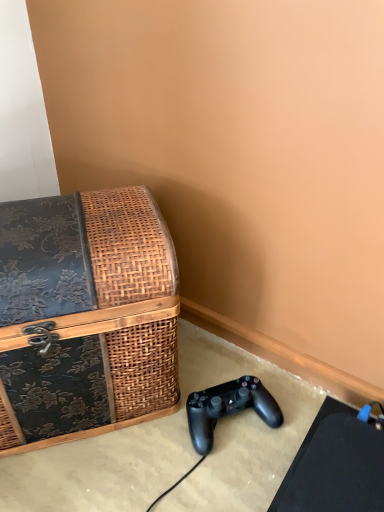
What is the approximate height of black matte game controller at lower right?

The height of black matte game controller at lower right is 2.71 inches.

The width and height of the screenshot is (384, 512). Describe the element at coordinates (228, 408) in the screenshot. I see `black matte game controller at lower right` at that location.

Where is `black matte game controller at lower right`? black matte game controller at lower right is located at coordinates (228, 408).

Identify the location of woven wood trunk at left. (85, 316).

This screenshot has height=512, width=384. What do you see at coordinates (85, 316) in the screenshot?
I see `woven wood trunk at left` at bounding box center [85, 316].

Where is `black matte game controller at lower right`? The width and height of the screenshot is (384, 512). black matte game controller at lower right is located at coordinates (228, 408).

Which object is positioned more to the right, woven wood trunk at left or black matte game controller at lower right?

black matte game controller at lower right.

Is woven wood trunk at left in front of black matte game controller at lower right?

Yes, the depth of woven wood trunk at left is less than that of black matte game controller at lower right.

Is point (90, 315) in front of point (202, 412)?

Yes.

From the image's perspective, which one is positioned lower, woven wood trunk at left or black matte game controller at lower right?

black matte game controller at lower right.

From a real-world perspective, does woven wood trunk at left sit lower than black matte game controller at lower right?

Actually, woven wood trunk at left is physically above black matte game controller at lower right in the real world.

Considering the sizes of woven wood trunk at left and black matte game controller at lower right in the image, is woven wood trunk at left wider or thinner than black matte game controller at lower right?

Considering their sizes, woven wood trunk at left looks broader than black matte game controller at lower right.

Is woven wood trunk at left taller or shorter than black matte game controller at lower right?

Considering their sizes, woven wood trunk at left has more height than black matte game controller at lower right.

Considering the sizes of woven wood trunk at left and black matte game controller at lower right in the image, is woven wood trunk at left bigger or smaller than black matte game controller at lower right?

Considering their sizes, woven wood trunk at left takes up more space than black matte game controller at lower right.

Is woven wood trunk at left positioned beyond the bounds of black matte game controller at lower right?

Yes.

Is woven wood trunk at left in contact with black matte game controller at lower right?

No, woven wood trunk at left is not beside black matte game controller at lower right.

Is woven wood trunk at left aimed at black matte game controller at lower right?

No, woven wood trunk at left does not turn towards black matte game controller at lower right.

How different are the orientations of woven wood trunk at left and black matte game controller at lower right in degrees?

3.29 degrees separate the facing orientations of woven wood trunk at left and black matte game controller at lower right.

The width and height of the screenshot is (384, 512). In order to click on game controller located behind the woven wood trunk at left in this screenshot , I will do `click(228, 408)`.

Considering the relative positions of black matte game controller at lower right and woven wood trunk at left in the image provided, is black matte game controller at lower right to the left or to the right of woven wood trunk at left?

From the image, it's evident that black matte game controller at lower right is to the right of woven wood trunk at left.

Is the position of black matte game controller at lower right more distant than that of woven wood trunk at left?

Yes, it is behind woven wood trunk at left.

Considering the positions of points (238, 380) and (91, 248), is point (238, 380) closer to camera compared to point (91, 248)?

No.

From the image's perspective, is black matte game controller at lower right located above woven wood trunk at left?

No, from the image's perspective, black matte game controller at lower right is not on top of woven wood trunk at left.

In the scene shown: From a real-world perspective, which object stands above the other?

woven wood trunk at left, from a real-world perspective.

Considering the sizes of objects black matte game controller at lower right and woven wood trunk at left in the image provided, who is wider, black matte game controller at lower right or woven wood trunk at left?

woven wood trunk at left is wider.

From their relative heights in the image, would you say black matte game controller at lower right is taller or shorter than woven wood trunk at left?

Clearly, black matte game controller at lower right is shorter compared to woven wood trunk at left.

Is black matte game controller at lower right bigger than woven wood trunk at left?

Actually, black matte game controller at lower right might be smaller than woven wood trunk at left.

Could woven wood trunk at left be considered to be inside black matte game controller at lower right?

No.

Would you consider black matte game controller at lower right to be distant from woven wood trunk at left?

No.

Is black matte game controller at lower right facing towards woven wood trunk at left?

No, black matte game controller at lower right does not turn towards woven wood trunk at left.

Where is `game controller behind the woven wood trunk at left`? The width and height of the screenshot is (384, 512). game controller behind the woven wood trunk at left is located at coordinates (228, 408).

Find the location of a particular element. This screenshot has height=512, width=384. game controller below the woven wood trunk at left (from the image's perspective) is located at coordinates coord(228,408).

You are a GUI agent. You are given a task and a screenshot of the screen. Output one action in this format:
    pyautogui.click(x=<x>, y=<y>)
    Task: Click on the box located on the left of black matte game controller at lower right
    This screenshot has height=512, width=384.
    Given the screenshot: What is the action you would take?
    pyautogui.click(x=85, y=316)